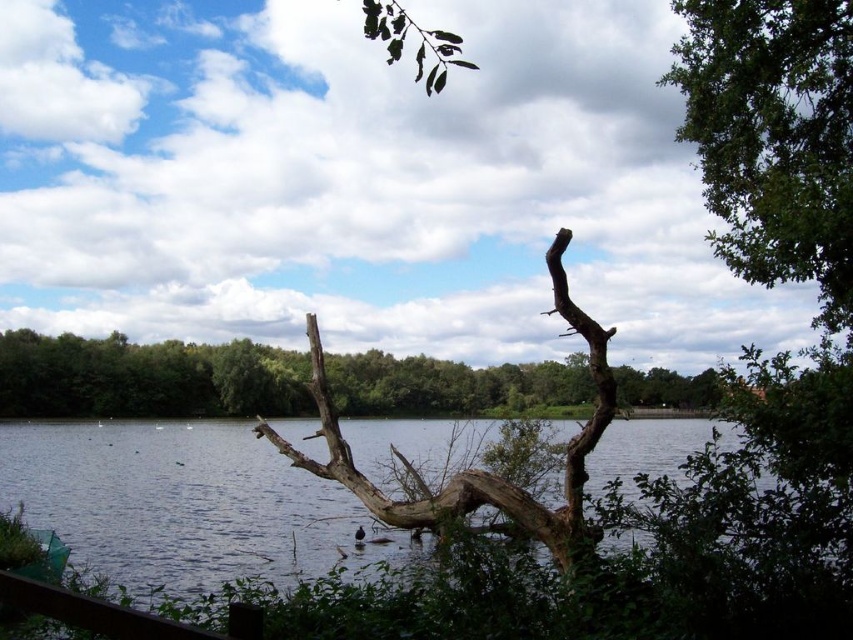
Can you confirm if brown wood water at center is positioned above green leafy tree at upper right?

Actually, brown wood water at center is below green leafy tree at upper right.

Can you confirm if brown wood water at center is thinner than green leafy tree at upper right?

In fact, brown wood water at center might be wider than green leafy tree at upper right.

Who is more distant from viewer, [251,458] or [759,108]?

Positioned behind is point [251,458].

Find the location of a particular element. brown wood water at center is located at coordinates (621, 563).

Is green leafy tree at upper right smaller than brown rough tree trunk at center?

Yes.

Which is behind, point (807, 80) or point (303, 394)?

The point (303, 394) is more distant.

Is point (828, 304) farther from viewer compared to point (408, 394)?

No, it is in front of (408, 394).

Locate an element on the screen. This screenshot has height=640, width=853. green leafy tree at upper right is located at coordinates (775, 138).

Is brown wood water at center above brown rough wood at center?

Actually, brown wood water at center is below brown rough wood at center.

Looking at this image, does brown wood water at center have a lesser height compared to brown rough wood at center?

No.

Is point (219, 561) farther from viewer compared to point (567, 481)?

Yes, point (219, 561) is farther from viewer.

Locate an element on the screen. Image resolution: width=853 pixels, height=640 pixels. brown wood water at center is located at coordinates (621, 563).